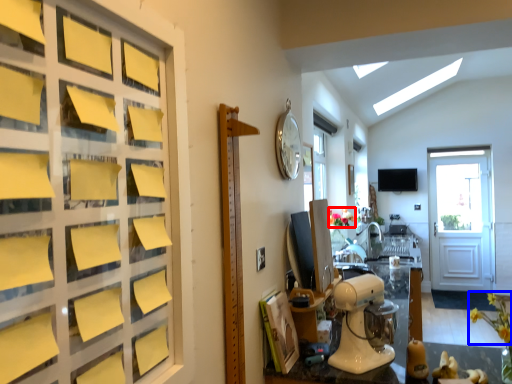
Question: Which of the following is the farthest to the observer, flower (highlighted by a red box) or flower (highlighted by a blue box)?

Choices:
 (A) flower
 (B) flower

Answer: (A)